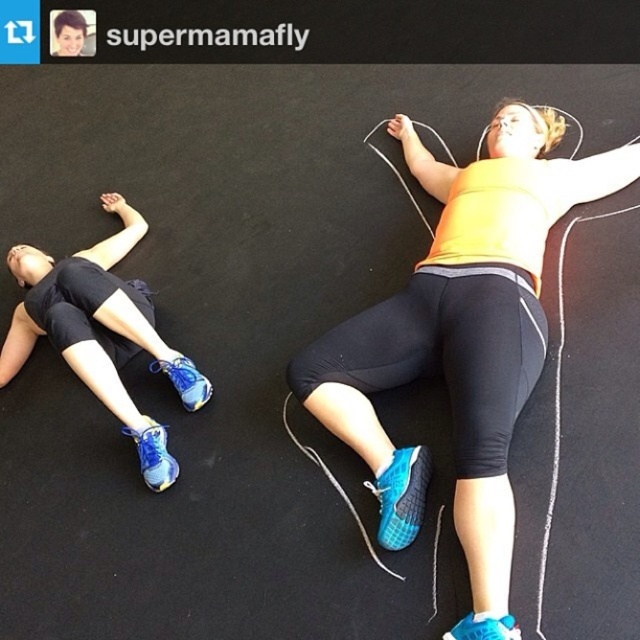
Can you confirm if yellow matte tank top at center is bigger than matte blue athletic shoe at upper left?

Yes.

Is point (465, 404) positioned after point (138, 305)?

No, it is not.

Find the location of a particular element. This screenshot has width=640, height=640. yellow matte tank top at center is located at coordinates (461, 339).